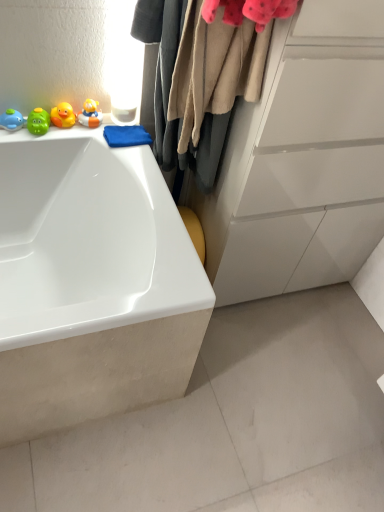
Question: Considering the relative sizes of rubber duck at left, which is the second toy in right-to-left order, and rubber duck at upper left, the 4th toy in the left-to-right sequence, in the image provided, is rubber duck at left, which is the second toy in right-to-left order, thinner than rubber duck at upper left, the 4th toy in the left-to-right sequence,?

Choices:
 (A) no
 (B) yes

Answer: (B)

Question: From the image's perspective, is rubber duck at left, which is counted as the 3th toy, starting from the left, located above rubber duck at upper left, the 4th toy in the left-to-right sequence?

Choices:
 (A) yes
 (B) no

Answer: (B)

Question: Is there a large distance between rubber duck at left, which is the second toy in right-to-left order, and rubber duck at upper left, the 4th toy in the left-to-right sequence?

Choices:
 (A) no
 (B) yes

Answer: (A)

Question: Is rubber duck at left, which is counted as the 3th toy, starting from the left, touching rubber duck at upper left, which ranks as the 1th toy in right-to-left order?

Choices:
 (A) no
 (B) yes

Answer: (B)

Question: Is rubber duck at left, which is the second toy in right-to-left order, not inside rubber duck at upper left, the 4th toy in the left-to-right sequence?

Choices:
 (A) no
 (B) yes

Answer: (B)

Question: From a real-world perspective, is rubber duck at left, which is counted as the 3th toy, starting from the left, above or below matte green rubber duck at left, which is counted as the 3th toy, starting from the right?

Choices:
 (A) below
 (B) above

Answer: (B)

Question: Relative to matte green rubber duck at left, the second toy positioned from the left, is rubber duck at left, which is counted as the 3th toy, starting from the left, in front or behind?

Choices:
 (A) front
 (B) behind

Answer: (B)

Question: Does point (61, 117) appear closer or farther from the camera than point (33, 117)?

Choices:
 (A) closer
 (B) farther

Answer: (B)

Question: Considering the positions of rubber duck at left, which is the second toy in right-to-left order, and matte green rubber duck at left, the second toy positioned from the left, in the image, is rubber duck at left, which is the second toy in right-to-left order, wider or thinner than matte green rubber duck at left, the second toy positioned from the left,?

Choices:
 (A) wide
 (B) thin

Answer: (A)

Question: Looking at the image, does rubber duck at left, which is the second toy in right-to-left order, seem bigger or smaller compared to beige woolen sweater at upper center?

Choices:
 (A) small
 (B) big

Answer: (A)

Question: From the image's perspective, is rubber duck at left, which is the second toy in right-to-left order, located above or below beige woolen sweater at upper center?

Choices:
 (A) above
 (B) below

Answer: (A)

Question: In the image, is rubber duck at left, which is counted as the 3th toy, starting from the left, on the left side or the right side of beige woolen sweater at upper center?

Choices:
 (A) right
 (B) left

Answer: (B)

Question: From a real-world perspective, is rubber duck at left, which is counted as the 3th toy, starting from the left, physically located above or below beige woolen sweater at upper center?

Choices:
 (A) below
 (B) above

Answer: (A)

Question: From the image's perspective, is beige woolen sweater at upper center above or below rubber duck at upper left, the 4th toy in the left-to-right sequence?

Choices:
 (A) below
 (B) above

Answer: (A)

Question: Is beige woolen sweater at upper center wider or thinner than rubber duck at upper left, which ranks as the 1th toy in right-to-left order?

Choices:
 (A) wide
 (B) thin

Answer: (A)